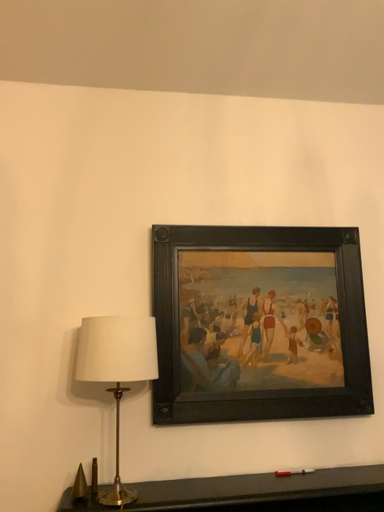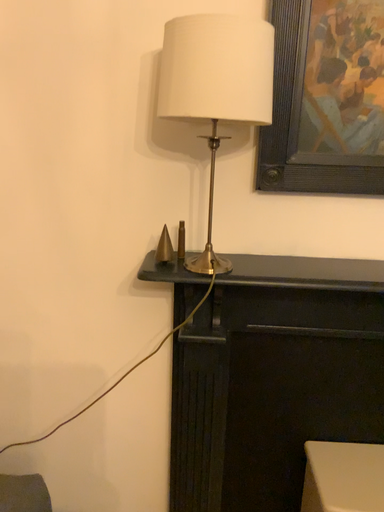
Question: Which way did the camera rotate in the video?

Choices:
 (A) rotated right
 (B) rotated left

Answer: (B)